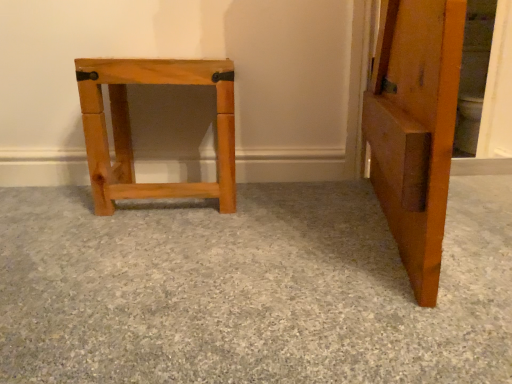
Question: Is natural wood stool at left beside natural wood stool at center?

Choices:
 (A) yes
 (B) no

Answer: (B)

Question: From the image's perspective, does natural wood stool at left appear higher than natural wood stool at center?

Choices:
 (A) no
 (B) yes

Answer: (A)

Question: Does natural wood stool at left have a smaller size compared to natural wood stool at center?

Choices:
 (A) yes
 (B) no

Answer: (B)

Question: Is natural wood stool at left positioned beyond the bounds of natural wood stool at center?

Choices:
 (A) yes
 (B) no

Answer: (A)

Question: Considering the relative positions of natural wood stool at left and natural wood stool at center in the image provided, is natural wood stool at left to the left of natural wood stool at center from the viewer's perspective?

Choices:
 (A) yes
 (B) no

Answer: (B)

Question: Does natural wood stool at left have a lesser height compared to natural wood stool at center?

Choices:
 (A) no
 (B) yes

Answer: (B)

Question: Is natural wood stool at center with natural wood stool at left?

Choices:
 (A) yes
 (B) no

Answer: (B)

Question: Could you tell me if natural wood stool at center is turned towards natural wood stool at left?

Choices:
 (A) yes
 (B) no

Answer: (A)

Question: Is natural wood stool at center to the left of natural wood stool at left from the viewer's perspective?

Choices:
 (A) yes
 (B) no

Answer: (A)

Question: Considering the relative sizes of natural wood stool at center and natural wood stool at left in the image provided, is natural wood stool at center smaller than natural wood stool at left?

Choices:
 (A) yes
 (B) no

Answer: (A)

Question: Is natural wood stool at center outside natural wood stool at left?

Choices:
 (A) yes
 (B) no

Answer: (A)

Question: Is natural wood stool at center taller than natural wood stool at left?

Choices:
 (A) no
 (B) yes

Answer: (B)

Question: In the image, is natural wood stool at left positioned in front of or behind natural wood stool at center?

Choices:
 (A) front
 (B) behind

Answer: (A)